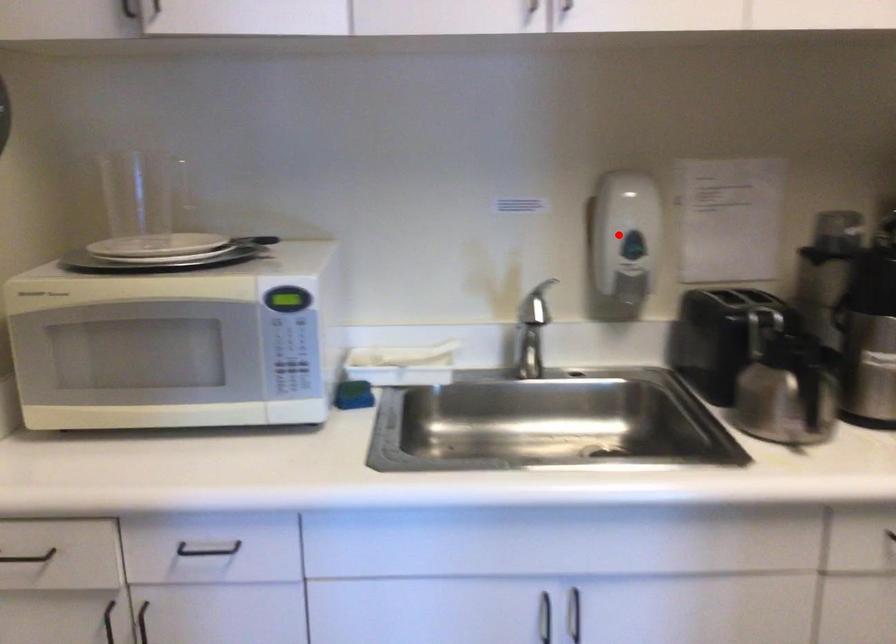
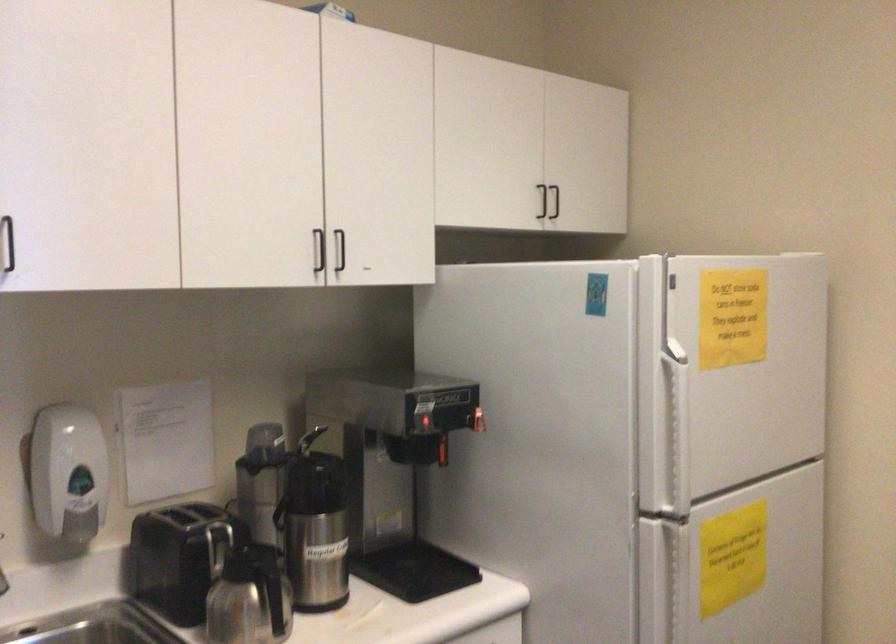
Where in the second image is the point corresponding to the highlighted location from the first image?

(67, 473)